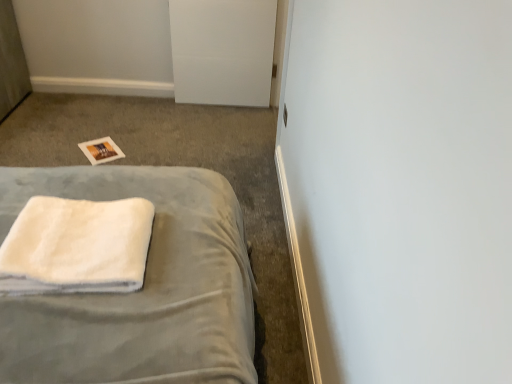
Question: Is white fluffy towel at lower left to the left of white matte door at upper center from the viewer's perspective?

Choices:
 (A) no
 (B) yes

Answer: (B)

Question: Considering the relative positions of white fluffy towel at lower left and white matte door at upper center in the image provided, is white fluffy towel at lower left in front of white matte door at upper center?

Choices:
 (A) no
 (B) yes

Answer: (B)

Question: From the image's perspective, is white fluffy towel at lower left above white matte door at upper center?

Choices:
 (A) yes
 (B) no

Answer: (B)

Question: Considering the relative sizes of white fluffy towel at lower left and white matte door at upper center in the image provided, is white fluffy towel at lower left thinner than white matte door at upper center?

Choices:
 (A) yes
 (B) no

Answer: (B)

Question: Are white fluffy towel at lower left and white matte door at upper center beside each other?

Choices:
 (A) no
 (B) yes

Answer: (A)

Question: Is white fluffy towel at lower left not inside white matte door at upper center?

Choices:
 (A) no
 (B) yes

Answer: (B)

Question: Can we say white soft towel at lower left lies outside white matte door at upper center?

Choices:
 (A) yes
 (B) no

Answer: (A)

Question: Considering the relative positions of white soft towel at lower left and white matte door at upper center in the image provided, is white soft towel at lower left to the right of white matte door at upper center from the viewer's perspective?

Choices:
 (A) yes
 (B) no

Answer: (B)

Question: Does white soft towel at lower left lie in front of white matte door at upper center?

Choices:
 (A) no
 (B) yes

Answer: (B)

Question: Does white soft towel at lower left have a lesser height compared to white matte door at upper center?

Choices:
 (A) yes
 (B) no

Answer: (A)

Question: From a real-world perspective, is white soft towel at lower left beneath white matte door at upper center?

Choices:
 (A) yes
 (B) no

Answer: (A)

Question: From the image's perspective, is white soft towel at lower left below white matte door at upper center?

Choices:
 (A) no
 (B) yes

Answer: (B)

Question: Considering the relative sizes of white soft towel at lower left and white fluffy towel at lower left in the image provided, is white soft towel at lower left bigger than white fluffy towel at lower left?

Choices:
 (A) no
 (B) yes

Answer: (B)